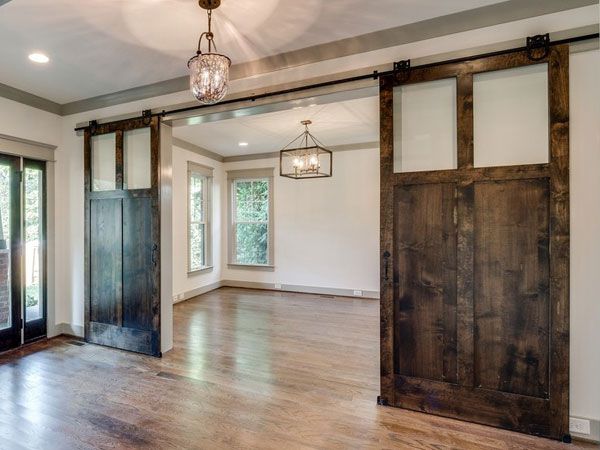
Locate an element on the screen. The width and height of the screenshot is (600, 450). window seal is located at coordinates (252, 265), (206, 269).